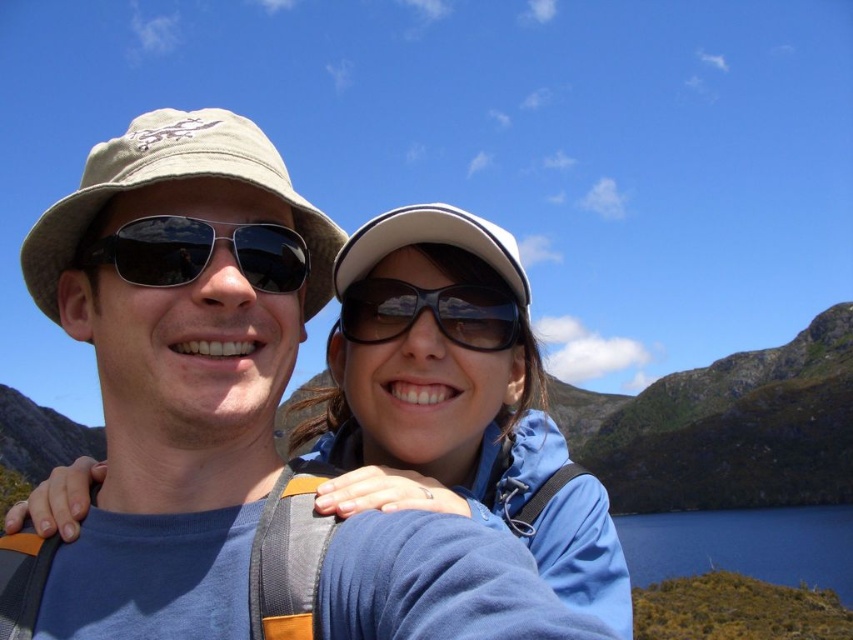
Which of these two, matte black sunglasses at center or black plastic sunglasses at center, stands shorter?

matte black sunglasses at center

Describe the element at coordinates (199, 252) in the screenshot. The width and height of the screenshot is (853, 640). I see `matte black sunglasses at center` at that location.

Is point (253, 262) in front of point (352, 298)?

That is True.

Image resolution: width=853 pixels, height=640 pixels. Find the location of `matte black sunglasses at center`. matte black sunglasses at center is located at coordinates (199, 252).

Between point (367, 371) and point (393, 310), which one is positioned in front?

Point (393, 310) is more forward.

Is point (445, 349) in front of point (491, 333)?

Yes.

Locate an element on the screen. The image size is (853, 640). matte blue jacket at center is located at coordinates (456, 397).

Which is above, matte blue jacket at center or khaki fabric hat at left?

khaki fabric hat at left is above.

Who is taller, matte blue jacket at center or khaki fabric hat at left?

Standing taller between the two is matte blue jacket at center.

Describe the element at coordinates (456, 397) in the screenshot. This screenshot has width=853, height=640. I see `matte blue jacket at center` at that location.

Find the location of a particular element. The image size is (853, 640). matte blue jacket at center is located at coordinates (456, 397).